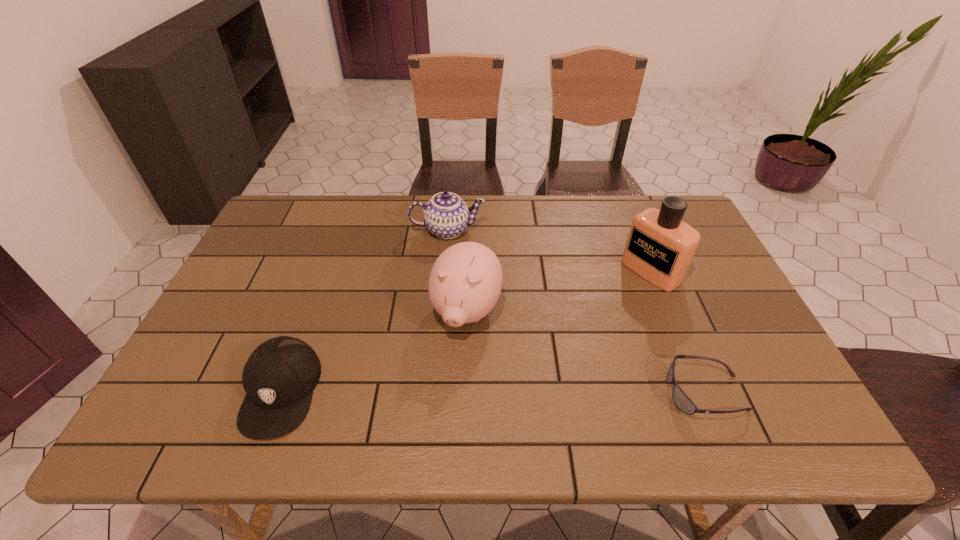
The height and width of the screenshot is (540, 960). What are the coordinates of `vacant space located at the spout of the chinaware` in the screenshot? It's located at (451, 296).

Identify the location of vacant region located at the spout of the chinaware. (450, 264).

Image resolution: width=960 pixels, height=540 pixels. I want to click on vacant space located at the spout of the chinaware, so click(451, 310).

This screenshot has height=540, width=960. I want to click on free space located 0.130m at the snout of the second tallest object, so click(439, 392).

Locate an element on the screen. The width and height of the screenshot is (960, 540). vacant space located at the snout of the second tallest object is located at coordinates (448, 366).

The width and height of the screenshot is (960, 540). I want to click on vacant space located 0.060m at the snout of the second tallest object, so click(x=448, y=366).

At what (x,y) coordinates should I click in order to perform the action: click on free location located on the front label of the perfume. Please return your answer as a coordinate pair (x, y). Looking at the image, I should click on (538, 351).

Where is `vacant space located on the front label of the perfume`? This screenshot has width=960, height=540. vacant space located on the front label of the perfume is located at coordinates (601, 307).

At what (x,y) coordinates should I click in order to perform the action: click on vacant space located 0.290m on the front label of the perfume. Please return your answer as a coordinate pair (x, y). The image size is (960, 540). Looking at the image, I should click on (562, 335).

This screenshot has height=540, width=960. Find the location of `object situated at the far edge`. object situated at the far edge is located at coordinates (446, 215).